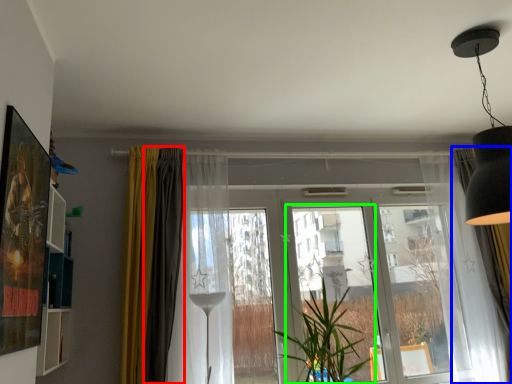
Question: Which object is positioned closest to curtain (highlighted by a red box)? Select from curtain (highlighted by a blue box) and screen door (highlighted by a green box).

Choices:
 (A) curtain
 (B) screen door

Answer: (B)